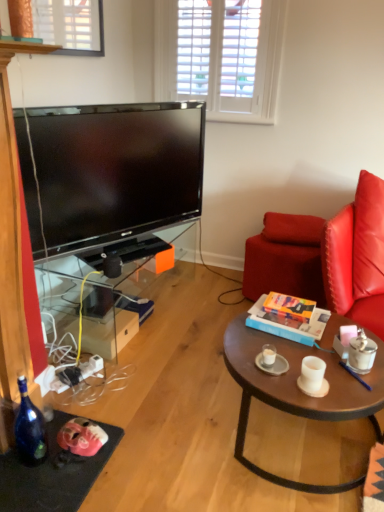
Locate an element on the screen. unoccupied area in front of white matte coffee cup at center, acting as the 1th coffee cup starting from the left is located at coordinates (284, 383).